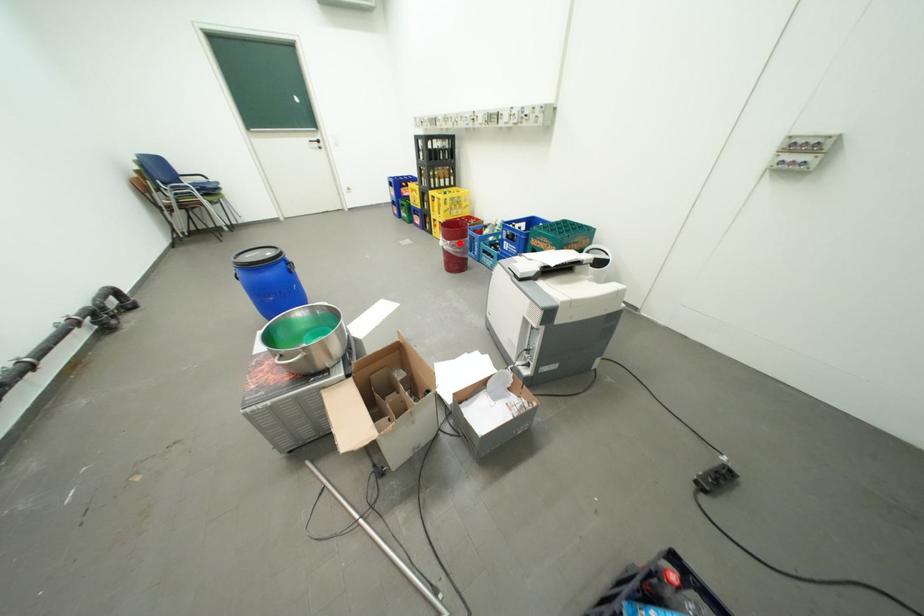
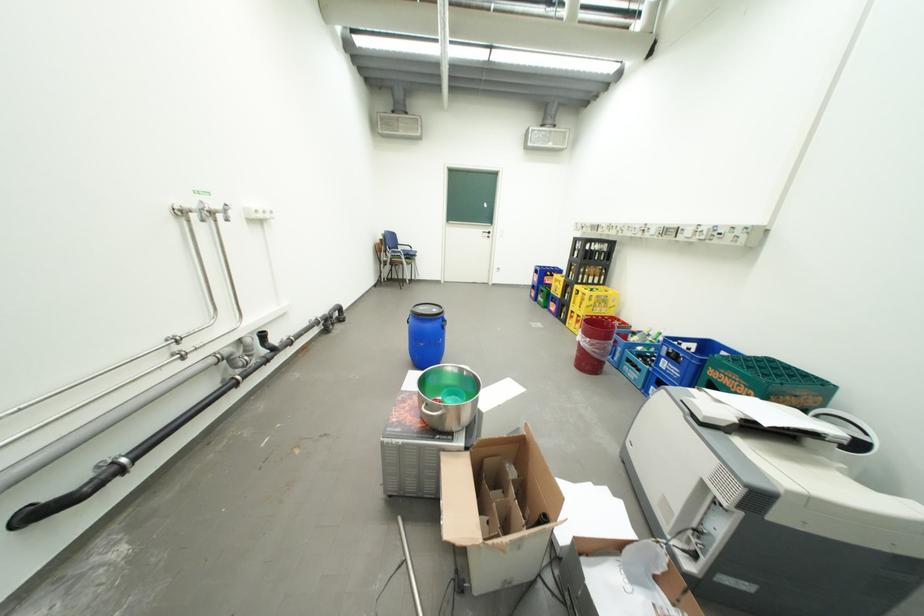
Question: I am providing you with two images of the same scene from different viewpoints. Image1 has a red point marked. In image2, the corresponding 3D location appears at what relative position? Reply with the corresponding letter.

Choices:
 (A) Closer
 (B) Farther

Answer: (A)